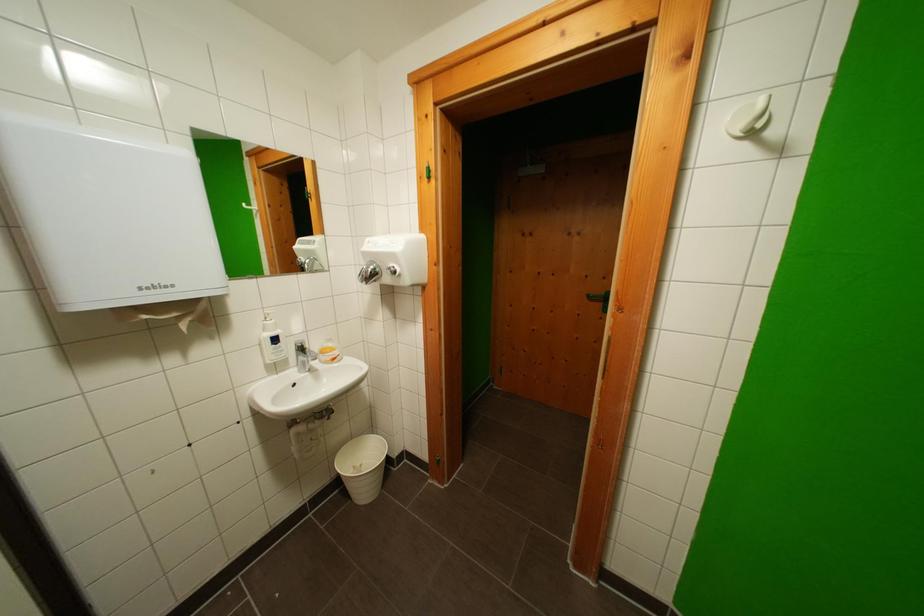
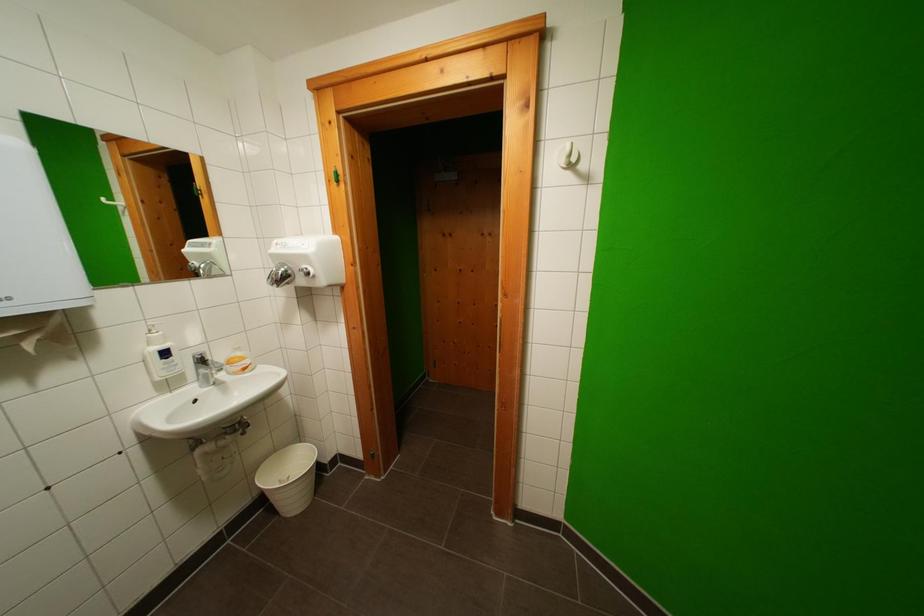
The images are taken continuously from a first-person perspective. In which direction are you moving?

The cameraman moved toward right, backward.